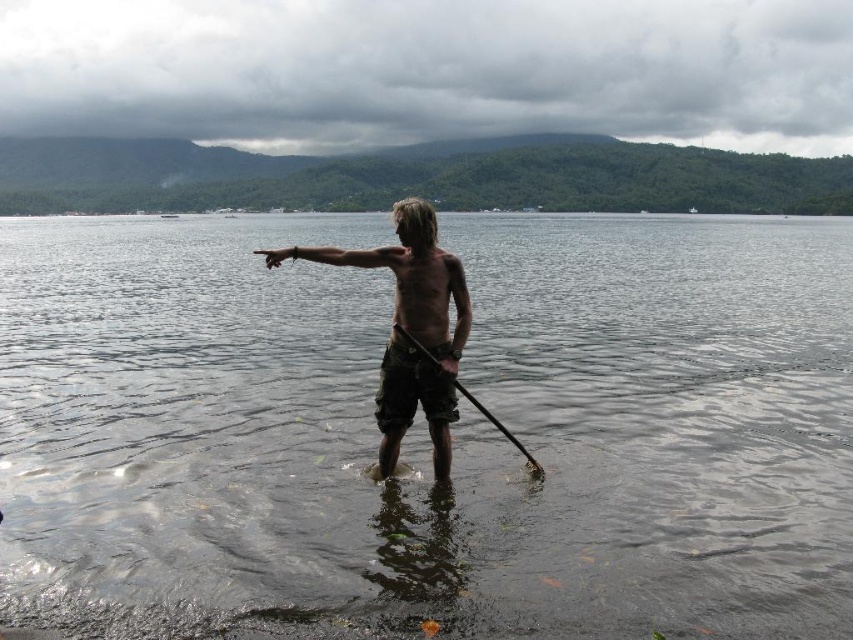
You are a fashion designer observing the scene and want to create a swimsuit that matches the brown camouflage shorts at center and the wooden smooth paddle at center. Which item has a wider design that you should focus on for the swimsuit pattern?

The brown camouflage shorts at center has a greater width than the wooden smooth paddle at center, so you should focus on the brown camouflage shorts at center for the swimsuit pattern.

Based on the photo, you are a photographer trying to capture the reflection of the person in the clear water at center. Since the brown camouflage shorts at center might block the reflection, where should you position yourself relative to the person to avoid the shorts blocking the view?

You should position yourself to the left of the person because the clear water at center is to the right of the brown camouflage shorts at center, so moving left would place the shorts between the person and your position, avoiding the obstruction.